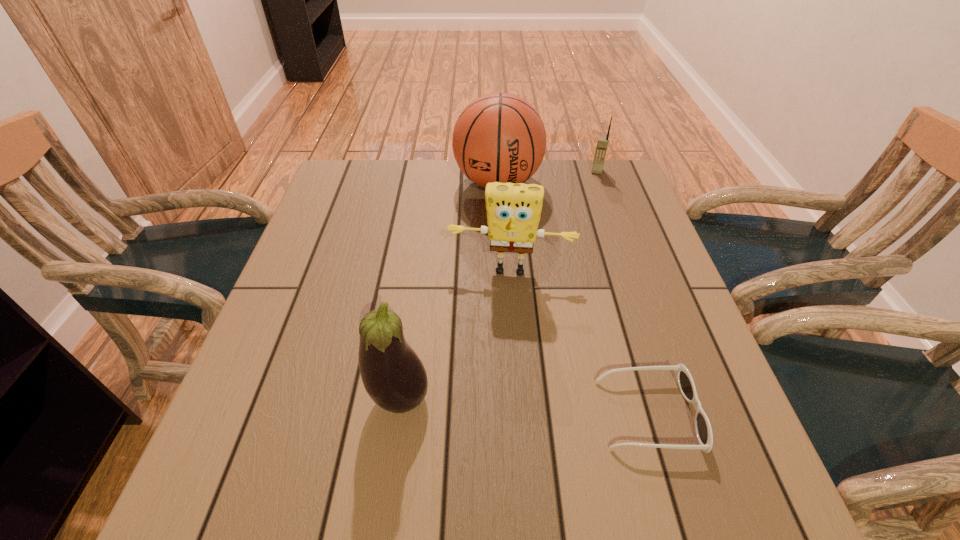
Identify the location of sunglasses at the right edge. The height and width of the screenshot is (540, 960). (685, 382).

You are a GUI agent. You are given a task and a screenshot of the screen. Output one action in this format:
    pyautogui.click(x=<x>, y=<y>)
    Task: Click on the cellular telephone located in the right edge section of the desktop
    The width and height of the screenshot is (960, 540).
    Given the screenshot: What is the action you would take?
    pyautogui.click(x=602, y=144)

In order to click on object present at the far right corner in this screenshot , I will do `click(602, 144)`.

Find the location of a particular element. The image size is (960, 540). object present at the near right corner is located at coordinates (685, 382).

In the image, there is a desktop. In order to click on free region at the far edge in this screenshot , I will do `click(484, 188)`.

In the image, there is a desktop. Identify the location of vacant space at the near edge. (475, 436).

Find the location of a particular element. This screenshot has height=540, width=960. free point at the left edge is located at coordinates (307, 265).

The image size is (960, 540). Identify the location of vacant space at the right edge of the desktop. (649, 320).

At what (x,y) coordinates should I click in order to perform the action: click on vacant position at the far right corner of the desktop. Please return your answer as a coordinate pair (x, y). This screenshot has width=960, height=540. Looking at the image, I should click on (624, 173).

Image resolution: width=960 pixels, height=540 pixels. Identify the location of vacant area between the basketball and the sunglasses. (573, 298).